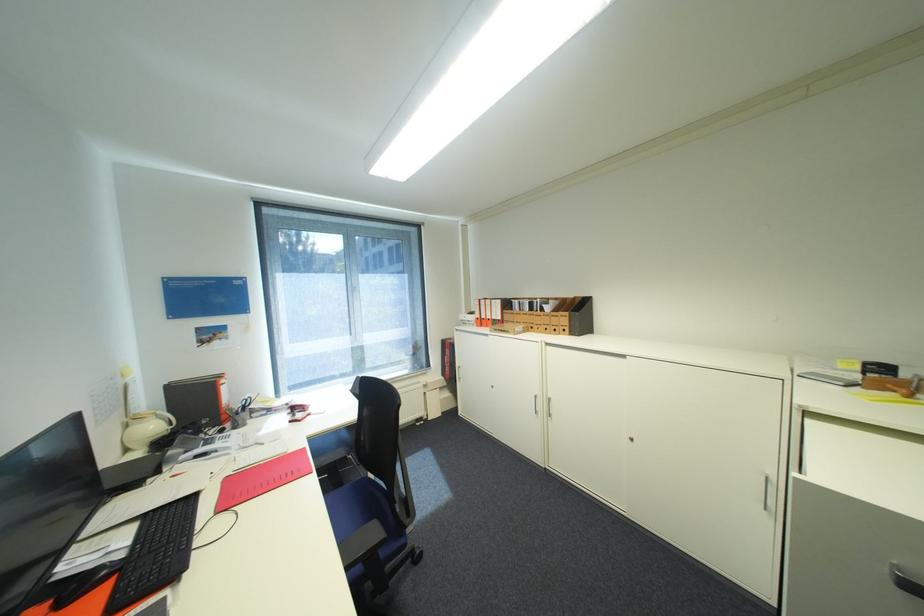
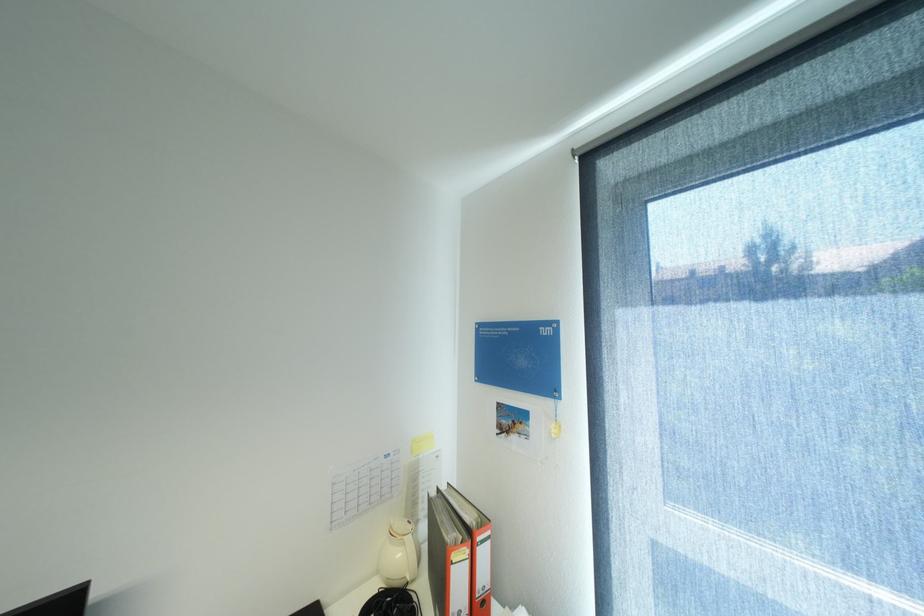
Locate, in the second image, the point that corresponds to pixel 161 427 in the first image.

(407, 554)